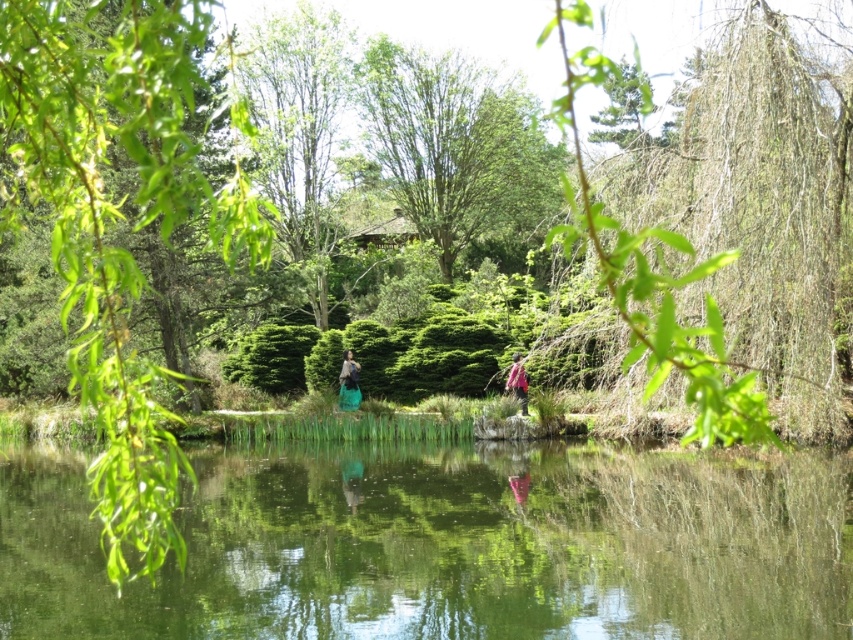
Does green leafy tree at upper right have a greater height compared to green leafy tree at center?

Indeed, green leafy tree at upper right has a greater height compared to green leafy tree at center.

Who is higher up, green leafy tree at upper right or green leafy tree at center?

Positioned higher is green leafy tree at center.

What do you see at coordinates (722, 252) in the screenshot? The width and height of the screenshot is (853, 640). I see `green leafy tree at upper right` at bounding box center [722, 252].

The image size is (853, 640). What are the coordinates of `green leafy tree at upper right` in the screenshot? It's located at (722, 252).

From the picture: Can you confirm if green reflective water at center is positioned below green leafy tree at upper right?

Yes, green reflective water at center is below green leafy tree at upper right.

The width and height of the screenshot is (853, 640). Identify the location of green reflective water at center. (447, 545).

Does green reflective water at center lie in front of green leafy branch at upper left?

That is False.

Which is more to the right, green reflective water at center or green leafy branch at upper left?

Positioned to the right is green reflective water at center.

Is point (775, 634) positioned behind point (165, 13)?

Yes, it is.

Find the location of `green reflective water at center`. green reflective water at center is located at coordinates (447, 545).